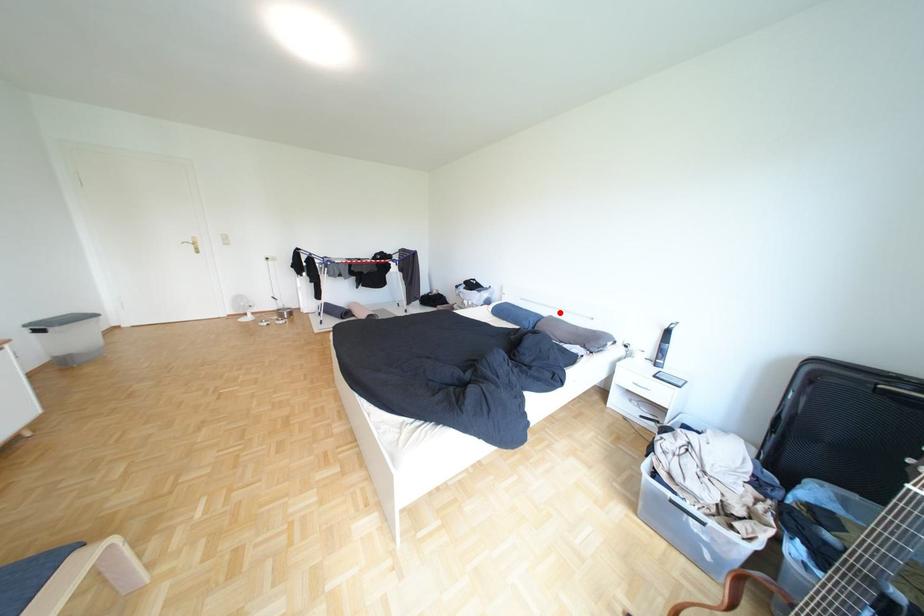
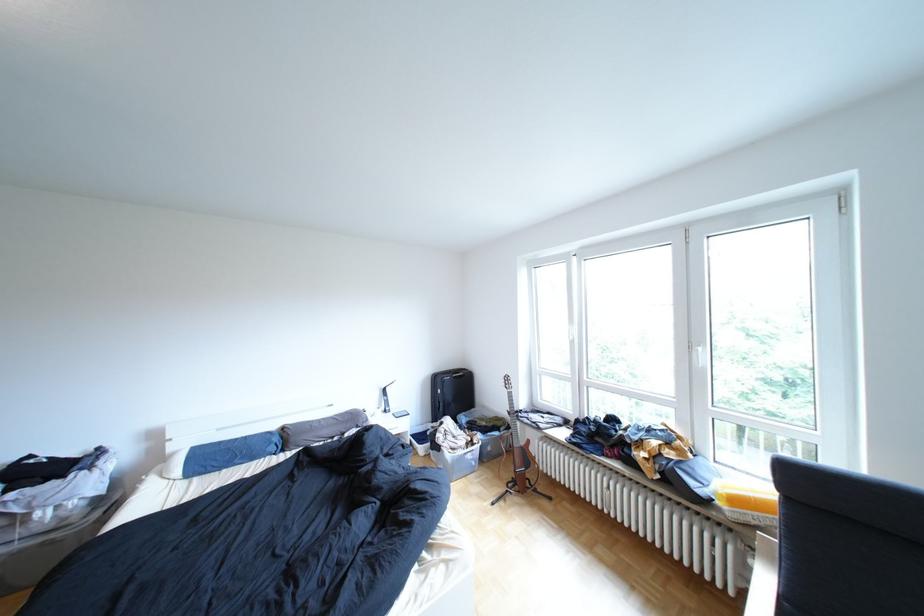
Where in the second image is the point corresponding to the highlighted location from the first image?

(289, 427)